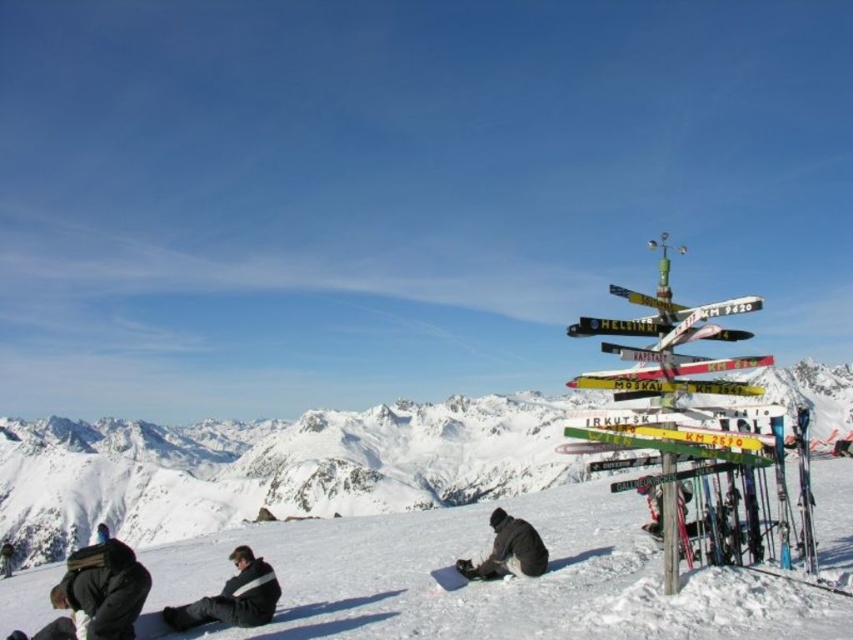
Question: Among these points, which one is farthest from the camera?

Choices:
 (A) (846, 563)
 (B) (523, 525)

Answer: (B)

Question: Estimate the real-world distances between objects in this image. Which object is closer to the dark gray jacket at lower left?

Choices:
 (A) dark gray jacket at lower center
 (B) black fleece jacket at lower left
 (C) white snow mountain at center
 (D) white powdery snow at lower center

Answer: (B)

Question: In this image, where is white powdery snow at lower center located relative to dark gray jacket at lower center?

Choices:
 (A) left
 (B) right

Answer: (A)

Question: Among these points, which one is nearest to the camera?

Choices:
 (A) (212, 444)
 (B) (102, 541)
 (C) (523, 536)

Answer: (B)

Question: Is white snow mountain at center smaller than dark gray jacket at lower center?

Choices:
 (A) no
 (B) yes

Answer: (A)

Question: Is dark gray jacket at lower left bigger than dark gray jacket at lower center?

Choices:
 (A) yes
 (B) no

Answer: (A)